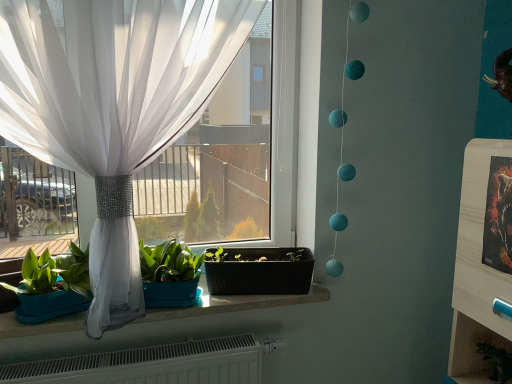
I want to click on white sheer curtain at left, so click(x=113, y=106).

The image size is (512, 384). What do you see at coordinates (471, 350) in the screenshot?
I see `wooden shelf at lower right` at bounding box center [471, 350].

What is the approximate height of metallic gold picture frame at right?

The height of metallic gold picture frame at right is 29.25 centimeters.

Image resolution: width=512 pixels, height=384 pixels. I want to click on matte white stone window sill at center, so click(234, 304).

Is the surface of wooden shelf at lower right in direct contact with matte white stone window sill at center?

wooden shelf at lower right is not next to matte white stone window sill at center, and they're not touching.

From the image's perspective, between wooden shelf at lower right and matte white stone window sill at center, who is located below?

wooden shelf at lower right is shown below in the image.

This screenshot has width=512, height=384. In order to click on shelf that appears in front of the matte white stone window sill at center in this screenshot , I will do `click(471, 350)`.

Is wooden shelf at lower right bigger than matte white stone window sill at center?

Actually, wooden shelf at lower right might be smaller than matte white stone window sill at center.

From the image's perspective, which one is positioned higher, metallic gold picture frame at right or white sheer curtain at left?

white sheer curtain at left appears higher in the image.

Does point (488, 257) lie behind point (202, 22)?

That is False.

Considering the positions of objects metallic gold picture frame at right and white sheer curtain at left in the image provided, who is more to the left, metallic gold picture frame at right or white sheer curtain at left?

white sheer curtain at left.

Does metallic gold picture frame at right turn towards white sheer curtain at left?

No, metallic gold picture frame at right is not turned towards white sheer curtain at left.

Considering the sizes of white sheer curtain at left and black plastic flowerpot at center in the image, is white sheer curtain at left wider or thinner than black plastic flowerpot at center?

white sheer curtain at left is wider than black plastic flowerpot at center.

Is white sheer curtain at left oriented away from black plastic flowerpot at center?

That's right, white sheer curtain at left is facing away from black plastic flowerpot at center.

From the image's perspective, is white sheer curtain at left located above or below black plastic flowerpot at center?

Based on their image positions, white sheer curtain at left is located above black plastic flowerpot at center.

Is white sheer curtain at left directly adjacent to black plastic flowerpot at center?

No, white sheer curtain at left is not next to black plastic flowerpot at center.

Is point (215, 306) closer or farther from the camera than point (243, 277)?

Point (215, 306) appears to be farther away from the viewer than point (243, 277).

Is matte white stone window sill at center not close to black plastic flowerpot at center?

Actually, matte white stone window sill at center and black plastic flowerpot at center are a little close together.

Which of these two, matte white stone window sill at center or black plastic flowerpot at center, is bigger?

With larger size is matte white stone window sill at center.

From the image's perspective, is matte white stone window sill at center under black plastic flowerpot at center?

Yes, from the image's perspective, matte white stone window sill at center is below black plastic flowerpot at center.

From a real-world perspective, which is physically below, matte white stone window sill at center or metallic gold picture frame at right?

matte white stone window sill at center.

Is point (234, 311) closer to camera compared to point (504, 199)?

No, (234, 311) is further to viewer.

Are matte white stone window sill at center and metallic gold picture frame at right making contact?

No, matte white stone window sill at center is not with metallic gold picture frame at right.

Looking at their sizes, would you say matte white stone window sill at center is wider or thinner than white sheer curtain at left?

Considering their sizes, matte white stone window sill at center looks slimmer than white sheer curtain at left.

Is matte white stone window sill at center oriented towards white sheer curtain at left?

Yes, matte white stone window sill at center faces towards white sheer curtain at left.

From the image's perspective, is matte white stone window sill at center above white sheer curtain at left?

No, from the image's perspective, matte white stone window sill at center is not above white sheer curtain at left.

How far apart are matte white stone window sill at center and white sheer curtain at left?

matte white stone window sill at center is 21.62 inches away from white sheer curtain at left.

From a real-world perspective, which object rests below the other?

In real-world perspective, wooden shelf at lower right is lower.

From the image's perspective, which one is positioned higher, wooden shelf at lower right or black plastic flowerpot at center?

black plastic flowerpot at center appears higher in the image.

Is wooden shelf at lower right far away from black plastic flowerpot at center?

wooden shelf at lower right is actually quite close to black plastic flowerpot at center.

This screenshot has height=384, width=512. I want to click on shelf that is below the matte white stone window sill at center (from the image's perspective), so click(471, 350).

Image resolution: width=512 pixels, height=384 pixels. In order to click on curtain on the left of metallic gold picture frame at right in this screenshot , I will do `click(113, 106)`.

From the image, which object appears to be nearer to white sheer curtain at left, wooden shelf at lower right or matte white stone window sill at center?

matte white stone window sill at center.

When comparing their distances from wooden shelf at lower right, does matte white stone window sill at center or black plastic flowerpot at center seem closer?

black plastic flowerpot at center is closer to wooden shelf at lower right.

Considering their positions, is wooden shelf at lower right positioned further to matte white stone window sill at center than black plastic flowerpot at center?

The object further to matte white stone window sill at center is wooden shelf at lower right.

Based on their spatial positions, is wooden shelf at lower right or black plastic flowerpot at center further from metallic gold picture frame at right?

black plastic flowerpot at center is further to metallic gold picture frame at right.

Looking at the image, which one is located further to white sheer curtain at left, metallic gold picture frame at right or wooden shelf at lower right?

wooden shelf at lower right is further to white sheer curtain at left.

Based on the photo, estimate the real-world distances between objects in this image. Which object is closer to black plastic flowerpot at center, matte white stone window sill at center or metallic gold picture frame at right?

Among the two, matte white stone window sill at center is located nearer to black plastic flowerpot at center.

Estimate the real-world distances between objects in this image. Which object is closer to metallic gold picture frame at right, white sheer curtain at left or wooden shelf at lower right?

Based on the image, wooden shelf at lower right appears to be nearer to metallic gold picture frame at right.

When comparing their distances from matte white stone window sill at center, does white sheer curtain at left or wooden shelf at lower right seem closer?

white sheer curtain at left is positioned closer to the anchor matte white stone window sill at center.

This screenshot has height=384, width=512. In order to click on curtain between matte white stone window sill at center and wooden shelf at lower right in the horizontal direction in this screenshot , I will do [113, 106].

The height and width of the screenshot is (384, 512). What are the coordinates of `window sill located between white sheer curtain at left and black plastic flowerpot at center in the depth direction` in the screenshot? It's located at (234, 304).

The image size is (512, 384). Identify the location of curtain located between matte white stone window sill at center and metallic gold picture frame at right in the left-right direction. (113, 106).

Identify the location of picture frame between white sheer curtain at left and wooden shelf at lower right from left to right. This screenshot has height=384, width=512. (498, 216).